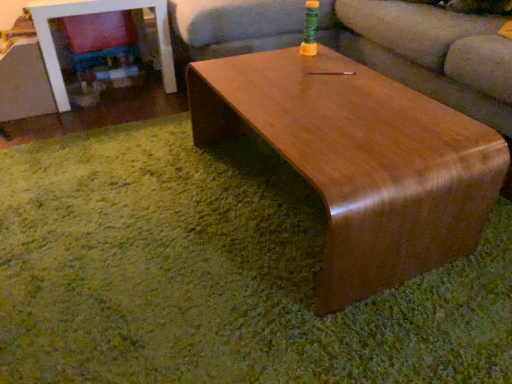
Where is `free spot in front of shiny brown wood coffee table at center`? This screenshot has height=384, width=512. free spot in front of shiny brown wood coffee table at center is located at coordinates (297, 316).